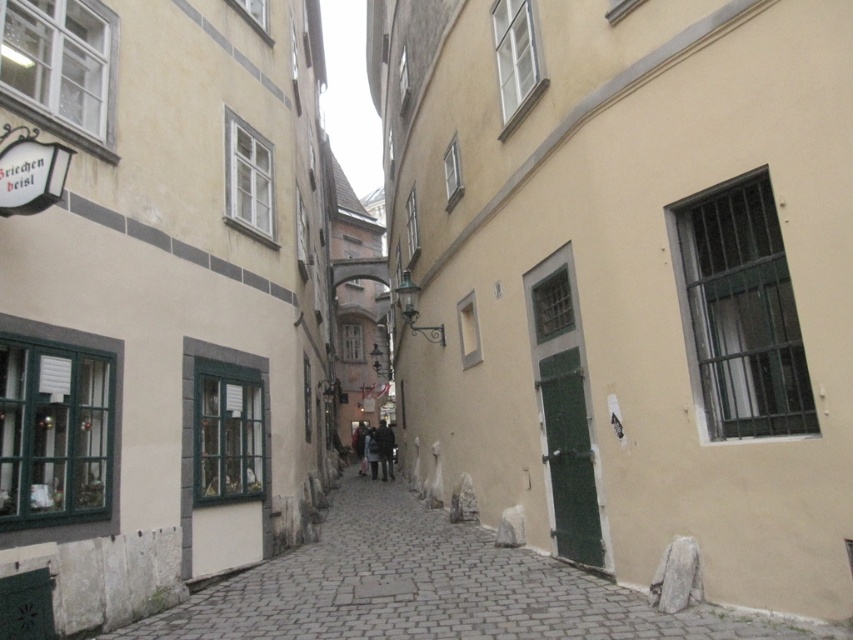
You are a delivery person with a cart that is 10 feet wide. You need to navigate through the narrow cobblestone alleyway shown in the image. There is a smooth stone wall at lower left and a dark gray fabric coat at center. Can your cart fit through the space between these two objects?

The distance between the smooth stone wall at lower left and the dark gray fabric coat at center is 33.37 feet. Since your cart is only 10 feet wide, it can easily fit through the space between these two objects as the available width is more than three times the cart width.